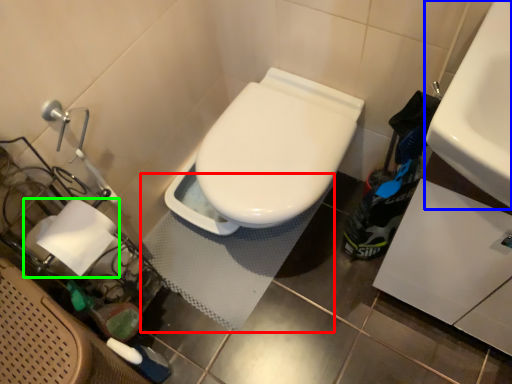
Question: Estimate the real-world distances between objects in this image. Which object is farther from bath mat (highlighted by a red box), sink (highlighted by a blue box) or toilet paper (highlighted by a green box)?

Choices:
 (A) sink
 (B) toilet paper

Answer: (A)